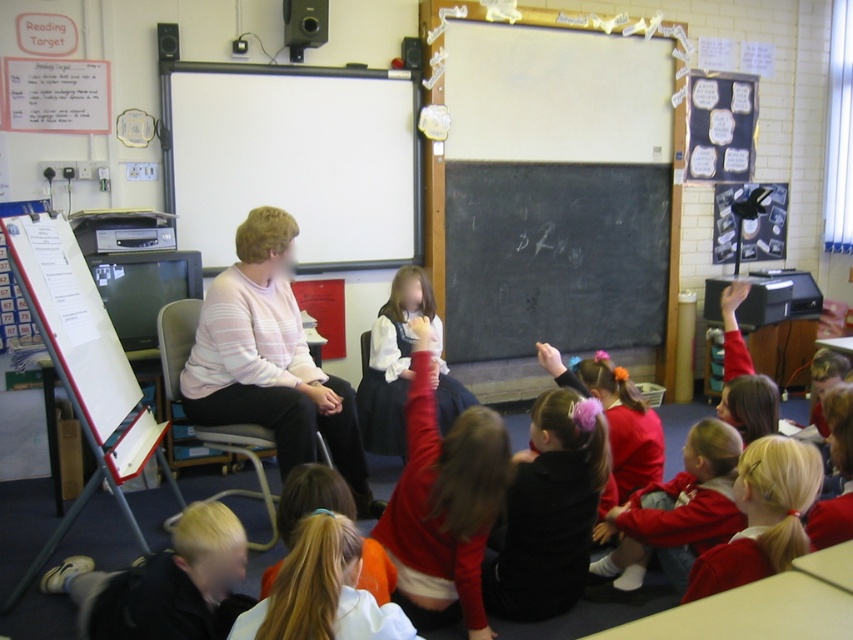
Question: Does blonde hair at lower left appear over blonde hair at lower center?

Choices:
 (A) yes
 (B) no

Answer: (B)

Question: Is whiteboard at upper center closer to camera compared to light pink striped sweater at center?

Choices:
 (A) no
 (B) yes

Answer: (A)

Question: Which point is closer to the camera?

Choices:
 (A) (619, 268)
 (B) (222, 538)
 (C) (762, 500)
 (D) (409, 93)

Answer: (C)

Question: Is whiteboard at upper center to the right of blonde hair at lower center from the viewer's perspective?

Choices:
 (A) yes
 (B) no

Answer: (B)

Question: Which point is closer to the camera?

Choices:
 (A) (421, 429)
 (B) (277, 598)
 (C) (740, 552)

Answer: (B)

Question: Which object is positioned closest to the white satin blouse at center?

Choices:
 (A) red fleece jacket at lower right
 (B) light pink striped sweater at center

Answer: (B)